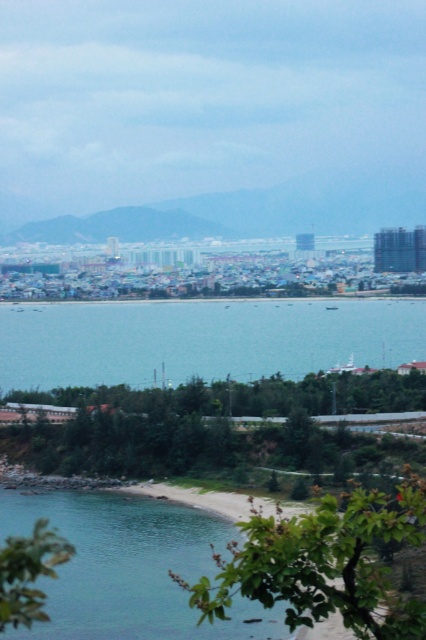
You are a swimmer planning to swim from the clear blue water at center to the clear water at beach lower left. Which direction should you swim to reach the smaller body of water?

You should swim towards the beach lower left direction because the clear water at beach lower left is smaller in size compared to the clear blue water at center.